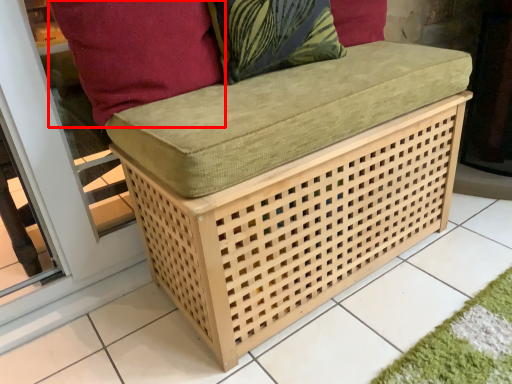
Question: From the image's perspective, what is the correct spatial positioning of pillow (annotated by the red box) in reference to throw pillow?

Choices:
 (A) above
 (B) below

Answer: (B)